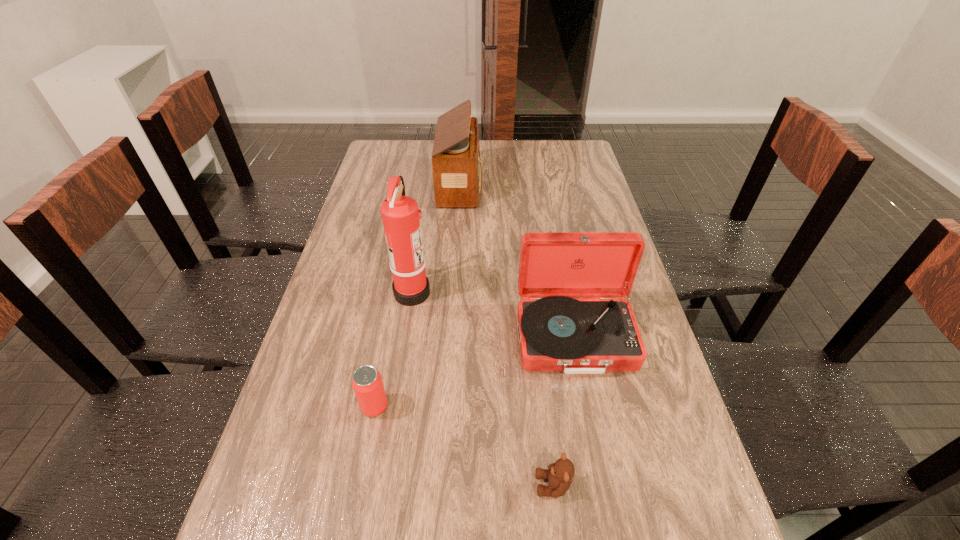
The image size is (960, 540). In order to click on the tallest object in this screenshot , I will do `click(400, 214)`.

This screenshot has width=960, height=540. Identify the location of radio receiver. (457, 175).

You are a GUI agent. You are given a task and a screenshot of the screen. Output one action in this format:
    pyautogui.click(x=<x>, y=<y>)
    Task: Click on the phonograph_record
    
    Given the screenshot: What is the action you would take?
    pyautogui.click(x=573, y=319)

Find the location of a particular element. the second shortest object is located at coordinates (367, 383).

In order to click on the second nearest object in this screenshot , I will do `click(367, 383)`.

Where is `the shortest object`? the shortest object is located at coordinates (559, 474).

Identify the location of the nearest object. This screenshot has width=960, height=540. (559, 474).

Find the location of a particular element. The width and height of the screenshot is (960, 540). vacant area located at the nozzle of the fire extinguisher is located at coordinates (539, 291).

The image size is (960, 540). I want to click on free location located 0.400m on the front panel of the farthest object, so click(x=592, y=185).

The image size is (960, 540). I want to click on blank space located 0.170m on the front-facing side of the phonograph_record, so click(x=596, y=450).